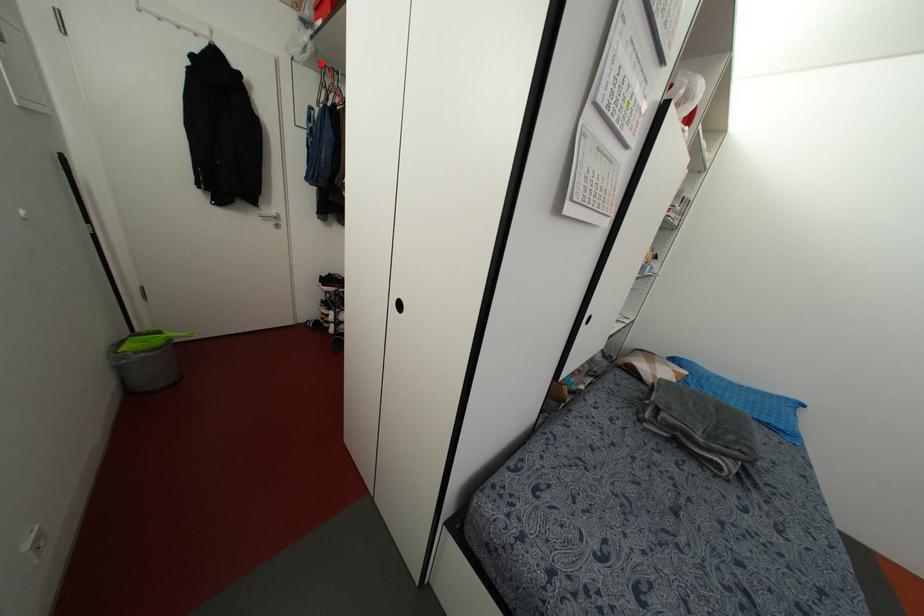
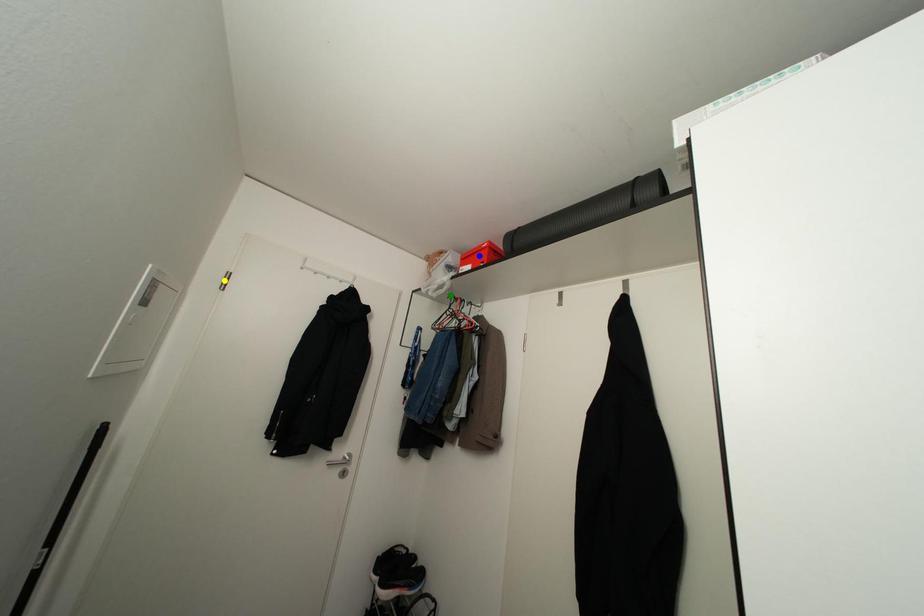
Question: I am providing you with two images of the same scene from different viewpoints. A red point is marked on the first image. You are given multiple points on the second image. Which point in image 2 represents the same 3d spot as the red point in image 1?

Choices:
 (A) green point
 (B) yellow point
 (C) blue point

Answer: (A)